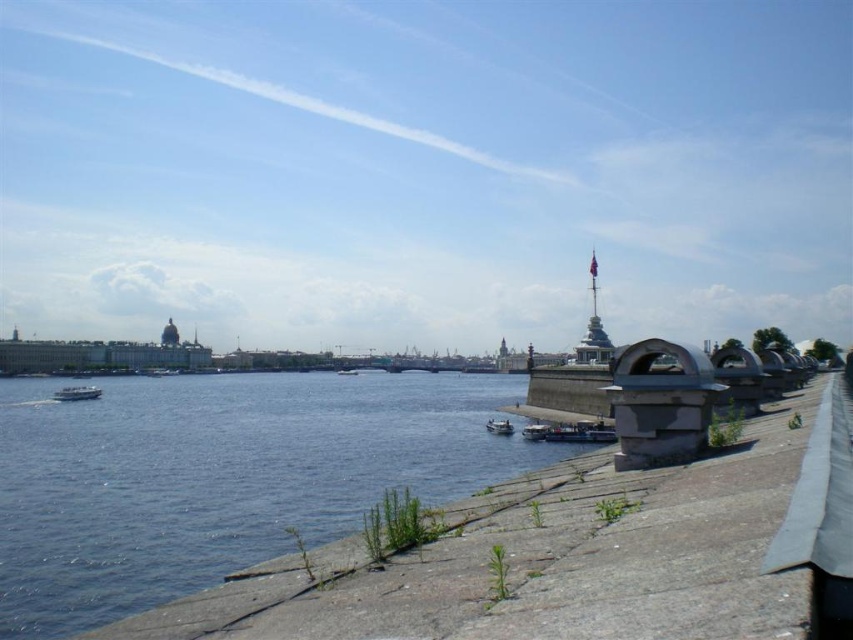
You are a photographer planning to capture both the white glossy boat at left and the metallic blue boat at lower center in a single frame. Which boat should you position closer to the center of your camera viewfinder to ensure both fit without cropping?

You should position the metallic blue boat at lower center closer to the center of your camera viewfinder because it is narrower than the white glossy boat at left, allowing more space for both in the frame.

You are standing on the concrete embankment and want to take a photo of both the white glossy boat at left and the metallic blue boat at lower center. Which boat should you focus on first if you want to capture both in the same frame without moving your camera?

You should focus on the white glossy boat at left first because it is much taller than the metallic blue boat at lower center, so adjusting the camera angle to include its height will naturally include the shorter boat in the frame.

You are standing at the concrete embankment with the river in front of you. You notice two points marked in the scene. Which point, point 1 at coordinates [508,426] or point 2 at coordinates [347,372], is closer to you?

Point 2 at coordinates [347,372] is closer to you because it is behind point 1 at coordinates [508,426], meaning point 1 is in front of point 2 and thus farther away.